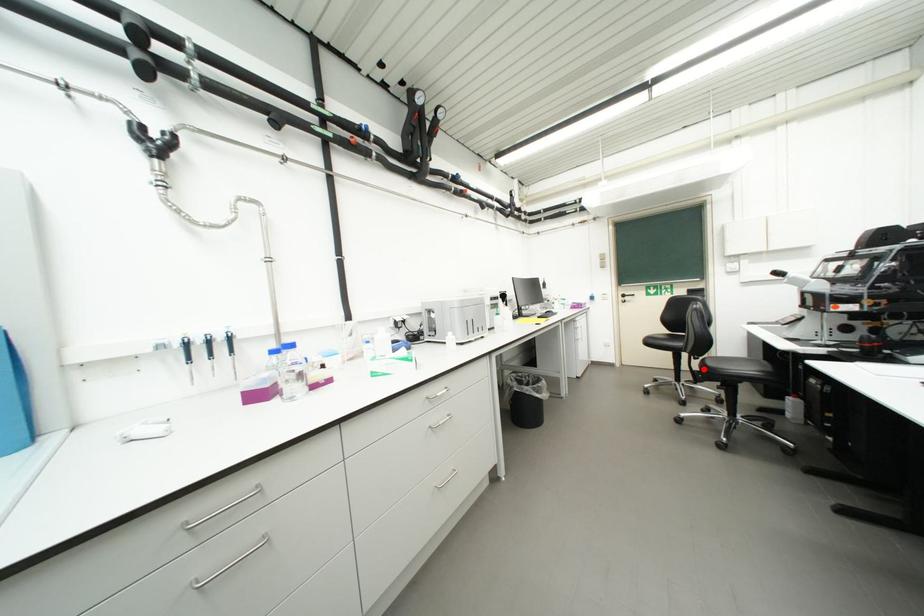
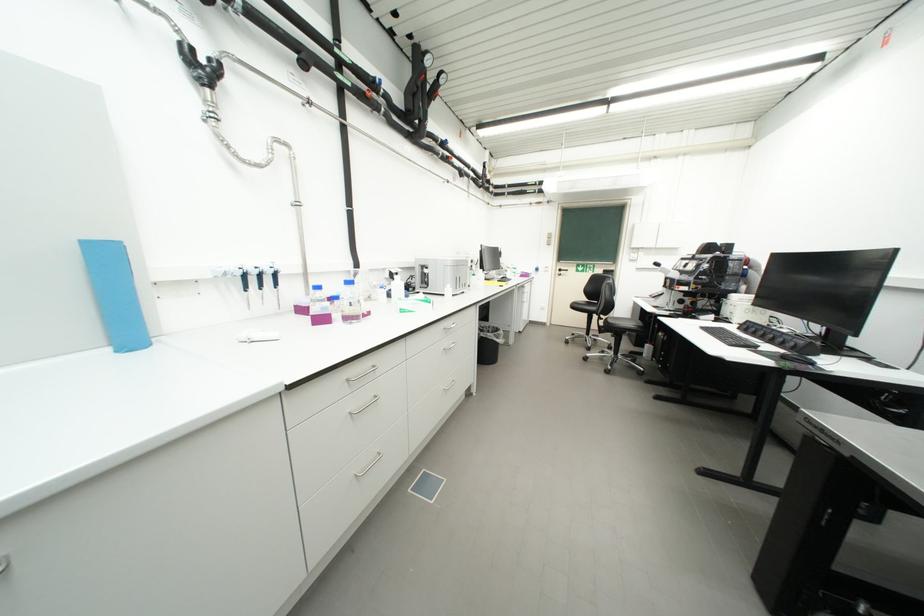
The point at the highlighted location is marked in the first image. Where is the corresponding point in the second image?

(610, 325)